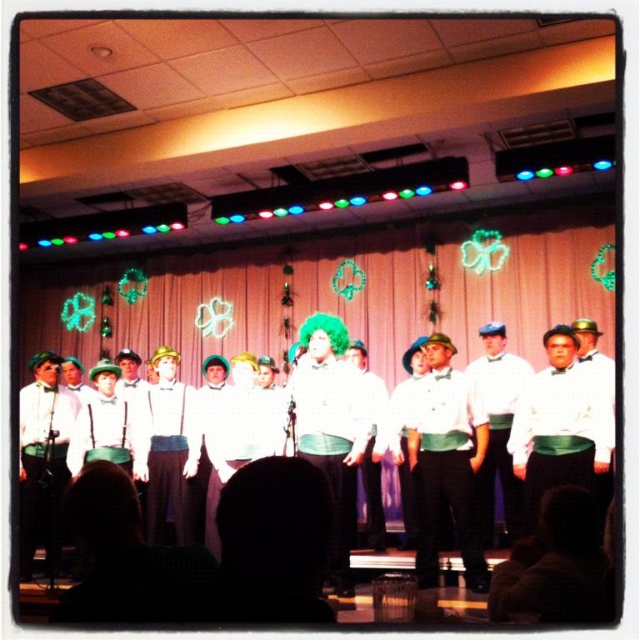
Image resolution: width=640 pixels, height=640 pixels. What do you see at coordinates (518, 484) in the screenshot?
I see `white fabric shirt at center` at bounding box center [518, 484].

Is white fabric shirt at center wider than white matte shirt at center?

Yes.

Find the location of a particular element. white fabric shirt at center is located at coordinates (518, 484).

This screenshot has width=640, height=640. Find the location of `white fabric shirt at center`. white fabric shirt at center is located at coordinates (518, 484).

Can you confirm if white satin bow tie at center is positioned to the left of white matte shirt at center?

Indeed, white satin bow tie at center is positioned on the left side of white matte shirt at center.

Can you confirm if white satin bow tie at center is bigger than white matte shirt at center?

Incorrect, white satin bow tie at center is not larger than white matte shirt at center.

Is point (429, 451) more distant than point (506, 516)?

No, (429, 451) is in front of (506, 516).

At what (x,y) coordinates should I click in order to perform the action: click on white satin bow tie at center. Please return your answer as a coordinate pair (x, y). Looking at the image, I should click on pos(445,468).

What do you see at coordinates (518, 484) in the screenshot? I see `white fabric shirt at center` at bounding box center [518, 484].

This screenshot has width=640, height=640. Identify the location of white fabric shirt at center. (518, 484).

Image resolution: width=640 pixels, height=640 pixels. I want to click on white fabric shirt at center, so click(x=518, y=484).